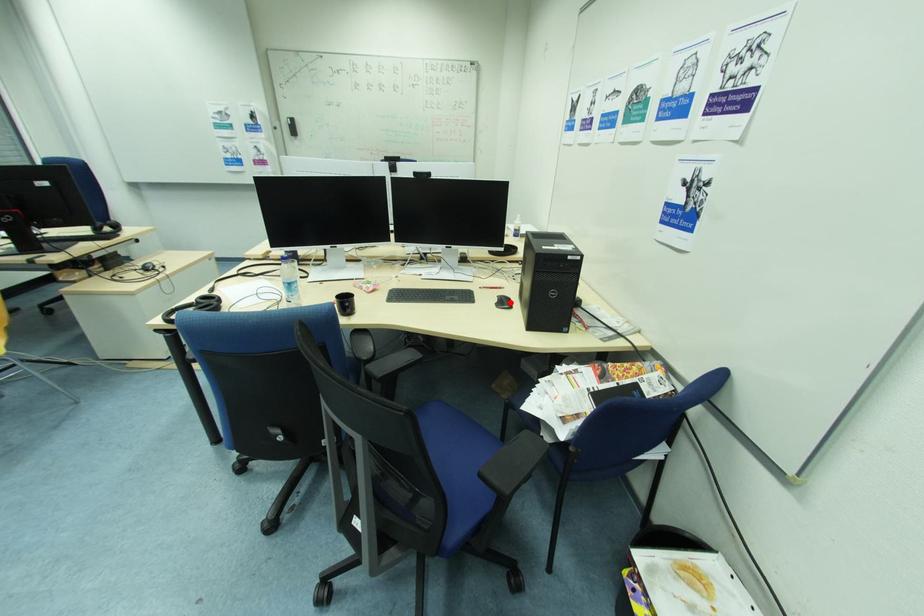
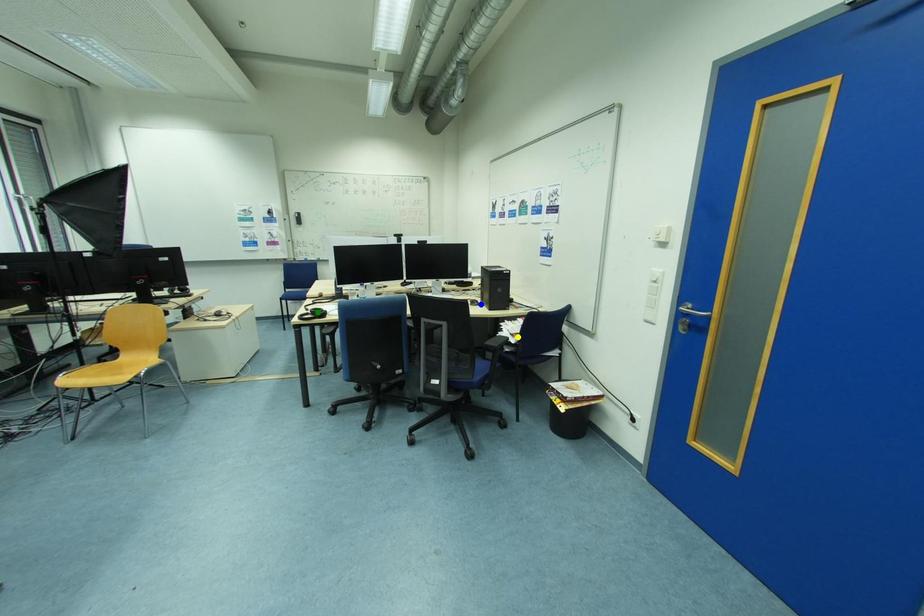
Question: I am providing you with two images of the same scene from different viewpoints. A red point is marked on the first image. You are given multiple points on the second image. Which spot in image 2 lines up with the point in image 1?

Choices:
 (A) yellow point
 (B) blue point
 (C) green point

Answer: (B)